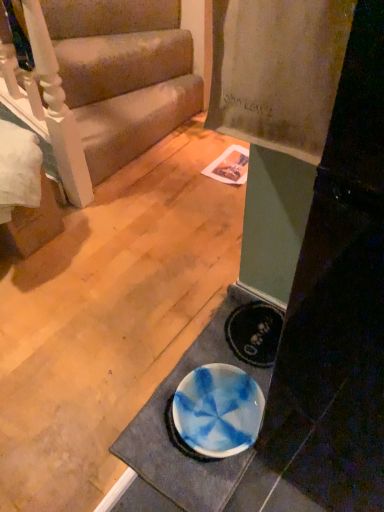
You are a GUI agent. You are given a task and a screenshot of the screen. Output one action in this format:
    pyautogui.click(x=<x>, y=<y>)
    Task: Click on the vacant space behind white glossy doormat at lower center
    This screenshot has width=384, height=512.
    Given the screenshot: What is the action you would take?
    pyautogui.click(x=178, y=293)